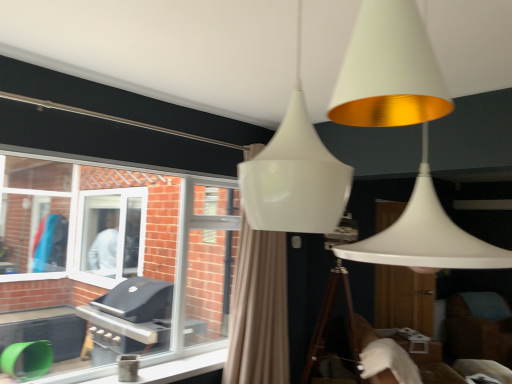
Question: Is clear glass window at left directly adjacent to beige fabric curtain at center?

Choices:
 (A) yes
 (B) no

Answer: (B)

Question: Does clear glass window at left have a larger size compared to beige fabric curtain at center?

Choices:
 (A) yes
 (B) no

Answer: (B)

Question: From a real-world perspective, is clear glass window at left beneath beige fabric curtain at center?

Choices:
 (A) yes
 (B) no

Answer: (B)

Question: Considering the relative positions of clear glass window at left and beige fabric curtain at center in the image provided, is clear glass window at left behind beige fabric curtain at center?

Choices:
 (A) yes
 (B) no

Answer: (B)

Question: Is clear glass window at left at the right side of beige fabric curtain at center?

Choices:
 (A) yes
 (B) no

Answer: (B)

Question: Considering the positions of beige fabric curtain at center and brown fabric swivel chair at lower right in the image, is beige fabric curtain at center taller or shorter than brown fabric swivel chair at lower right?

Choices:
 (A) short
 (B) tall

Answer: (B)

Question: From a real-world perspective, is beige fabric curtain at center above or below brown fabric swivel chair at lower right?

Choices:
 (A) above
 (B) below

Answer: (A)

Question: Is beige fabric curtain at center inside the boundaries of brown fabric swivel chair at lower right, or outside?

Choices:
 (A) outside
 (B) inside

Answer: (A)

Question: Would you say beige fabric curtain at center is to the left or to the right of brown fabric swivel chair at lower right in the picture?

Choices:
 (A) right
 (B) left

Answer: (B)

Question: In the image, is brown fabric swivel chair at lower right on the left side or the right side of beige fabric curtain at center?

Choices:
 (A) right
 (B) left

Answer: (A)

Question: In terms of height, does brown fabric swivel chair at lower right look taller or shorter compared to beige fabric curtain at center?

Choices:
 (A) short
 (B) tall

Answer: (A)

Question: From the image's perspective, is brown fabric swivel chair at lower right located above or below beige fabric curtain at center?

Choices:
 (A) above
 (B) below

Answer: (B)

Question: Considering their positions, is brown fabric swivel chair at lower right located in front of or behind beige fabric curtain at center?

Choices:
 (A) front
 (B) behind

Answer: (B)

Question: From the image's perspective, is clear glass window at left located above or below brown fabric swivel chair at lower right?

Choices:
 (A) below
 (B) above

Answer: (B)

Question: Which is correct: clear glass window at left is inside brown fabric swivel chair at lower right, or outside of it?

Choices:
 (A) outside
 (B) inside

Answer: (A)